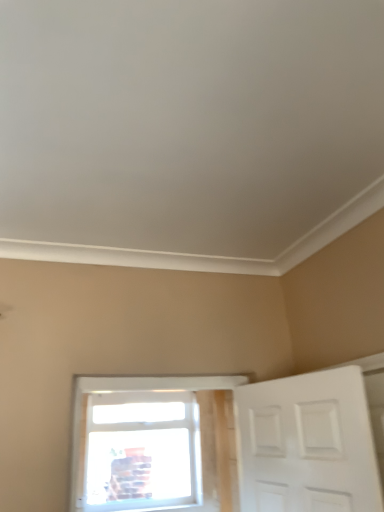
What do you see at coordinates (149, 442) in the screenshot?
I see `transparent glass window at center` at bounding box center [149, 442].

Where is `transparent glass window at center`? transparent glass window at center is located at coordinates (149, 442).

Locate an element on the screen. transparent glass window at center is located at coordinates (149, 442).